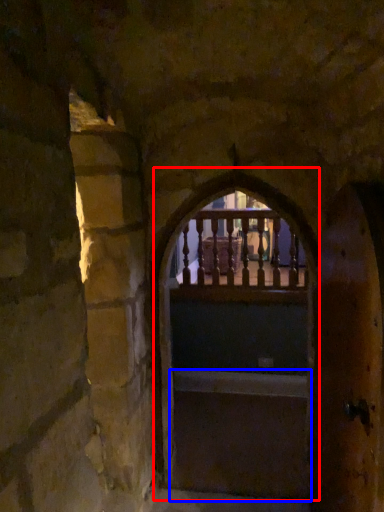
Question: Among these objects, which one is farthest to the camera, archway (highlighted by a red box) or stairs (highlighted by a blue box)?

Choices:
 (A) archway
 (B) stairs

Answer: (B)